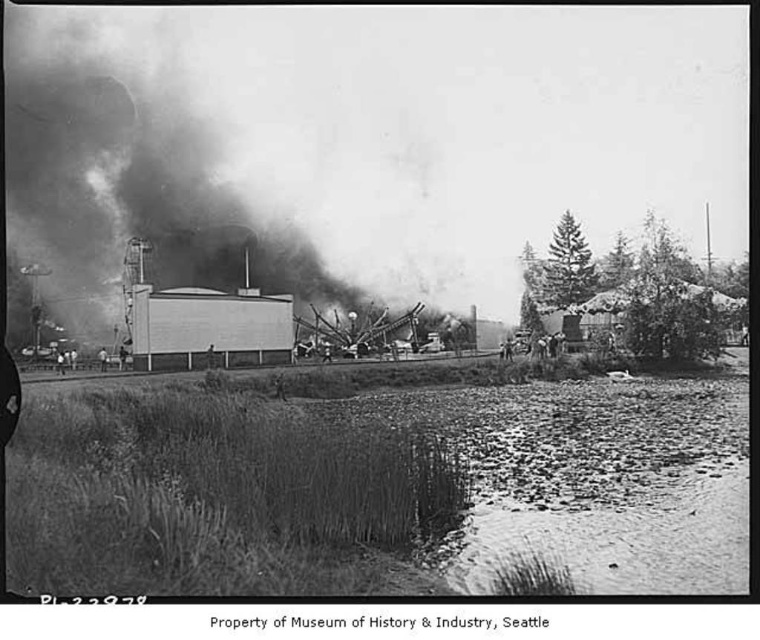
Which of these two, black smoke at upper left or smooth skin man at center, stands shorter?

Standing shorter between the two is smooth skin man at center.

Is point (257, 205) closer to viewer compared to point (106, 368)?

No, it is behind (106, 368).

This screenshot has width=760, height=640. What are the coordinates of `black smoke at upper left` in the screenshot? It's located at (176, 182).